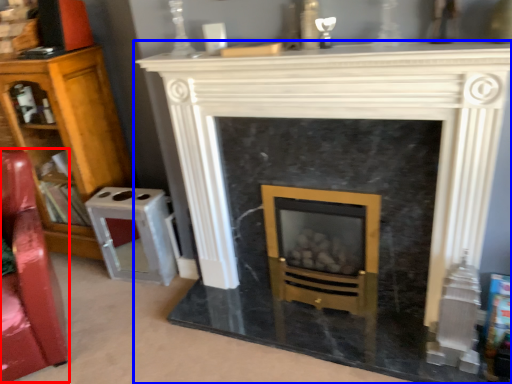
Question: Which object appears farthest to the camera in this image, swivel chair (highlighted by a red box) or fireplace (highlighted by a blue box)?

Choices:
 (A) swivel chair
 (B) fireplace

Answer: (A)